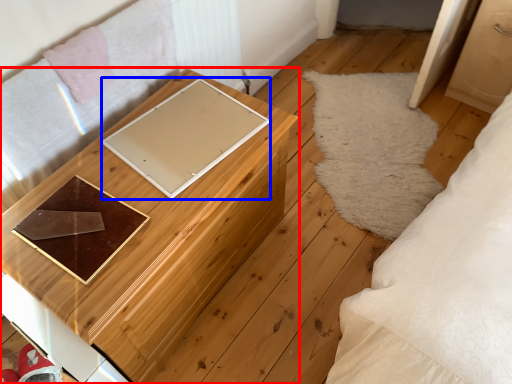
Question: Which object is closer to the camera taking this photo, furniture (highlighted by a red box) or pad (highlighted by a blue box)?

Choices:
 (A) furniture
 (B) pad

Answer: (A)